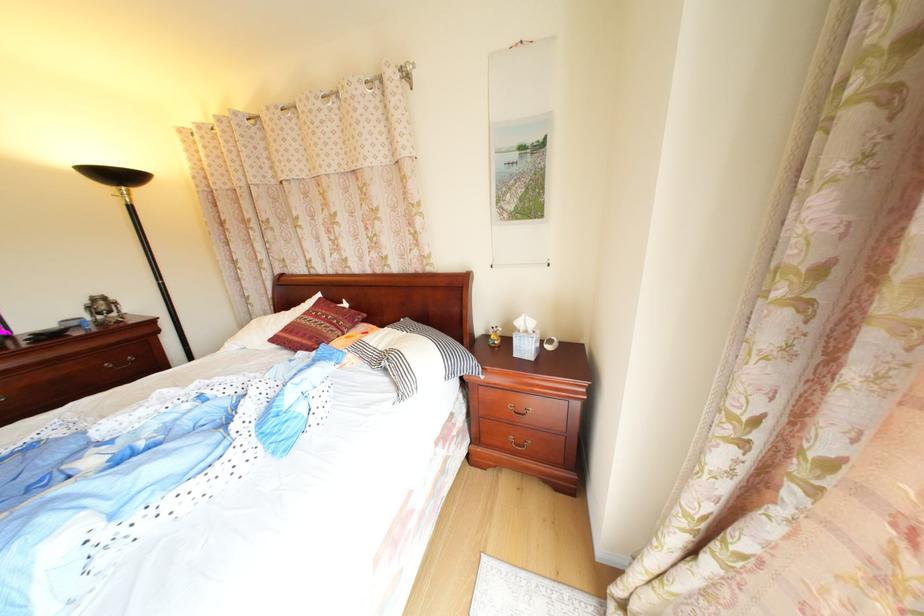
The location [103,310] corresponds to which object?

It corresponds to the metal alarm clock in the image.